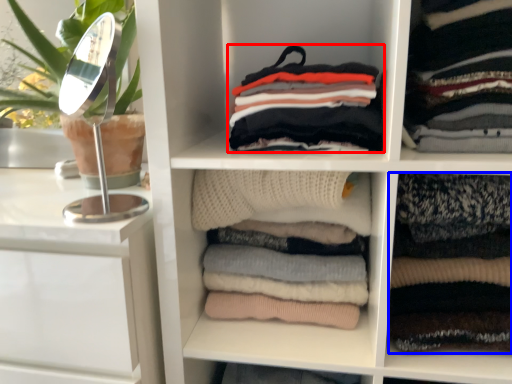
Question: Which object is further to the camera taking this photo, clothing (highlighted by a red box) or clothing (highlighted by a blue box)?

Choices:
 (A) clothing
 (B) clothing

Answer: (B)